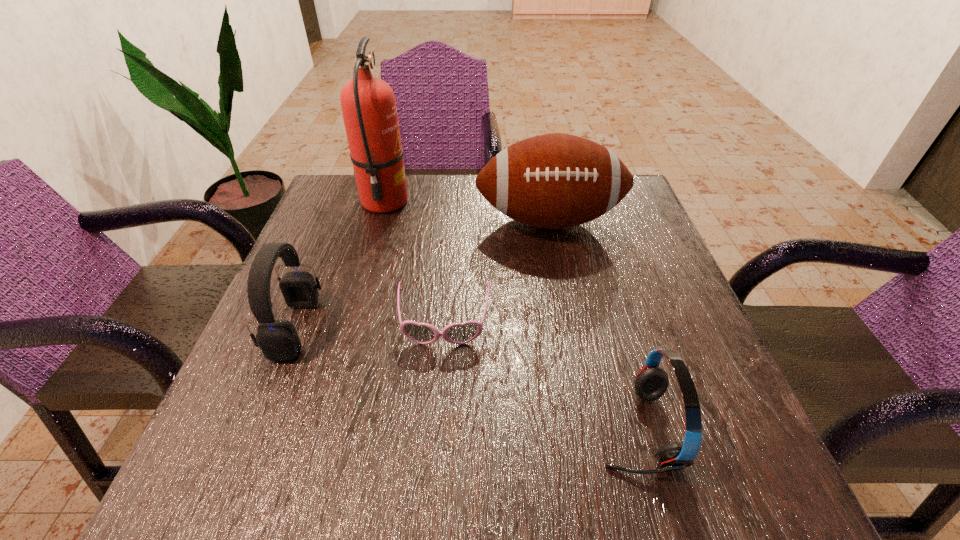
Identify the location of free space between the tallest object and the football. (467, 211).

Where is `vacant space that's between the second tallest object and the second object from left to right`? The image size is (960, 540). vacant space that's between the second tallest object and the second object from left to right is located at coordinates (467, 211).

Select which object is the third closest to the fourth object from right to left. Please provide its 2D coordinates. Your answer should be formatted as a tuple, i.e. [(x, y)], where the tuple contains the x and y coordinates of a point satisfying the conditions above.

[(422, 333)]

The image size is (960, 540). Identify the location of object that can be found as the fourth closest to the second tallest object. (651, 382).

You are a GUI agent. You are given a task and a screenshot of the screen. Output one action in this format:
    pyautogui.click(x=<x>, y=<y>)
    Task: Click on the vacant region that satisfies the following two spatial constraints: 1. on the front-facing side of the shortest object; 2. on the headband of the farther headset
    
    Given the screenshot: What is the action you would take?
    [x=444, y=328]